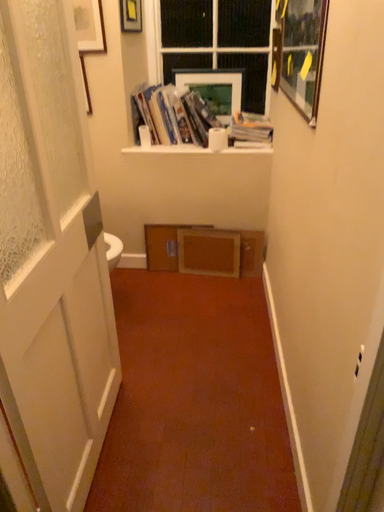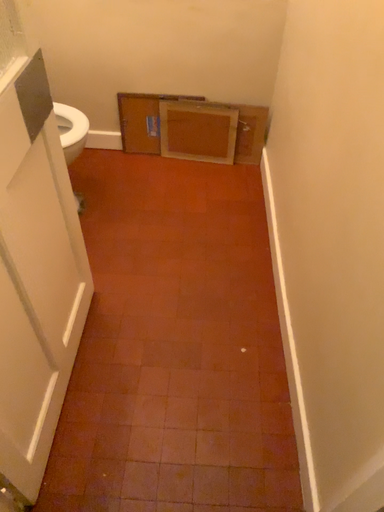
Question: Which way did the camera rotate in the video?

Choices:
 (A) rotated downward
 (B) rotated upward

Answer: (A)